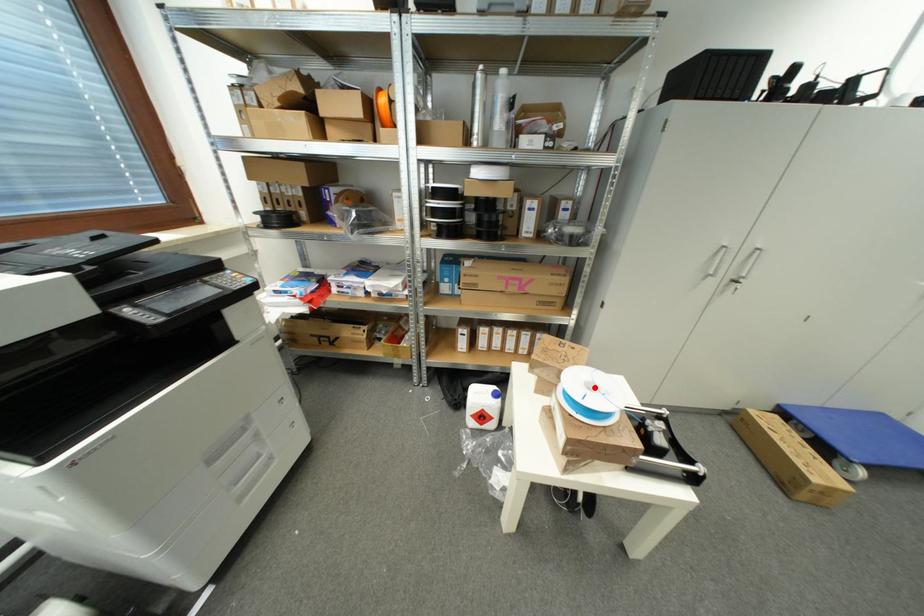
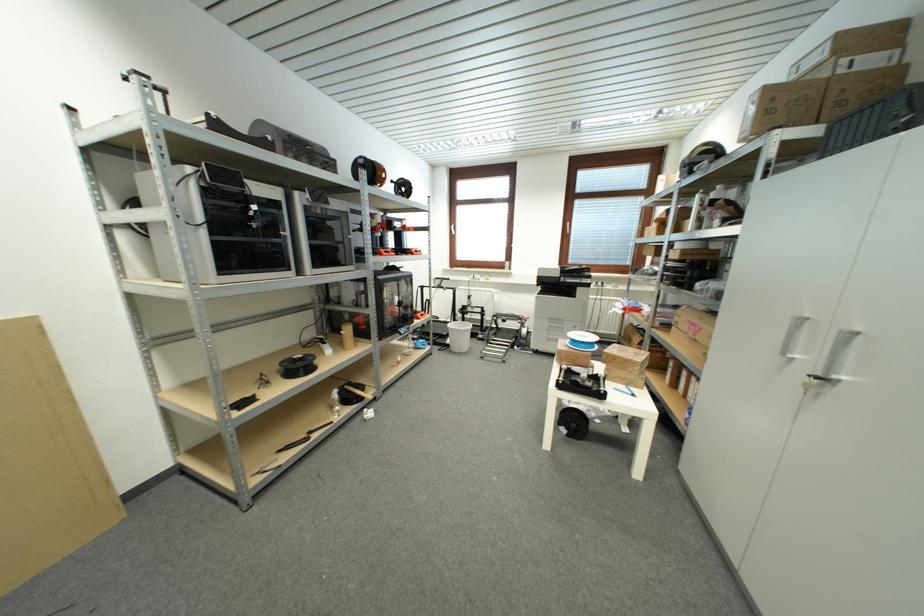
Question: I am providing you with two images of the same scene from different viewpoints. Given a red point in image1, look at the same physical point in image2. Is it:

Choices:
 (A) Closer to the viewpoint
 (B) Farther from the viewpoint

Answer: (A)